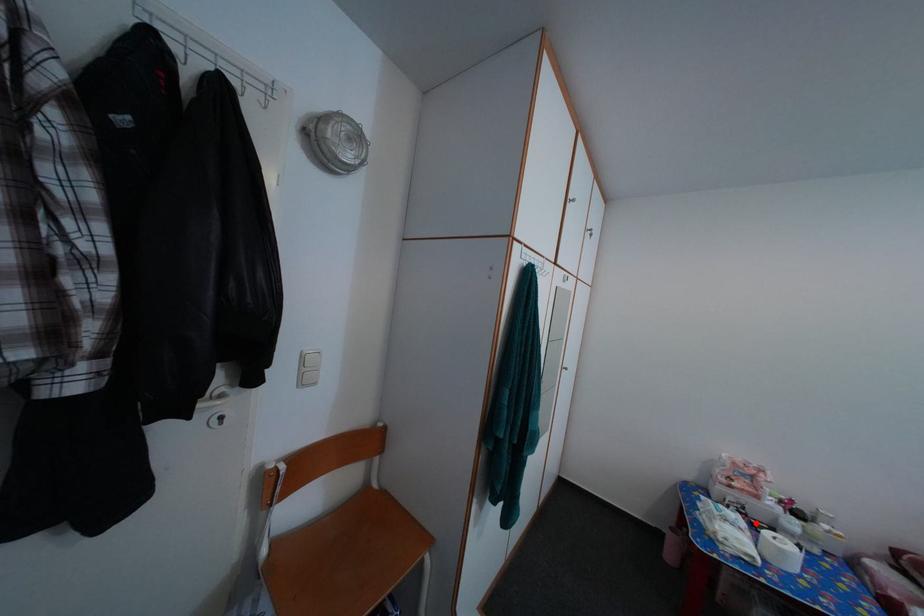
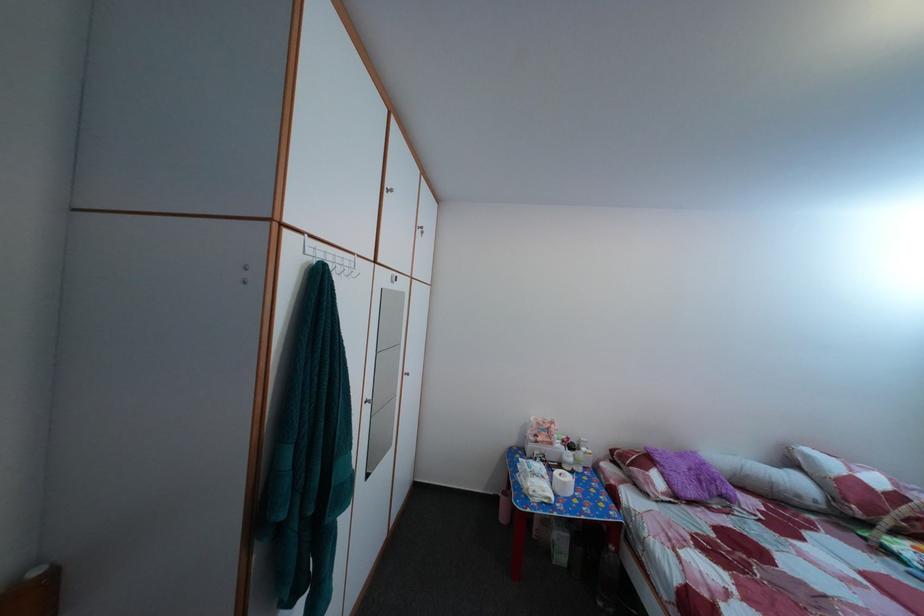
Question: I am providing you with two images of the same scene from different viewpoints. Image1 has a red point marked. In image2, the corresponding 3D location appears at what relative position? Reply with the corresponding letter.

Choices:
 (A) Closer
 (B) Farther

Answer: (B)